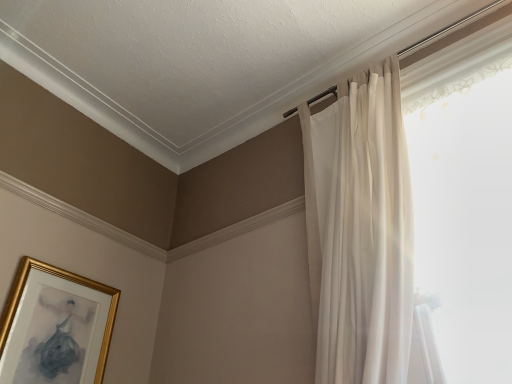
Question: Is gold-framed picture at lower left to the right of sheer white curtain at upper right from the viewer's perspective?

Choices:
 (A) yes
 (B) no

Answer: (B)

Question: From the image's perspective, is gold-framed picture at lower left located beneath sheer white curtain at upper right?

Choices:
 (A) no
 (B) yes

Answer: (B)

Question: From the image's perspective, is gold-framed picture at lower left over sheer white curtain at upper right?

Choices:
 (A) yes
 (B) no

Answer: (B)

Question: From a real-world perspective, is gold-framed picture at lower left on sheer white curtain at upper right?

Choices:
 (A) no
 (B) yes

Answer: (A)

Question: Would you say gold-framed picture at lower left is outside sheer white curtain at upper right?

Choices:
 (A) no
 (B) yes

Answer: (B)

Question: Is gold-framed picture at lower left looking in the opposite direction of sheer white curtain at upper right?

Choices:
 (A) no
 (B) yes

Answer: (A)

Question: Is sheer white curtain at upper right positioned in front of gold-framed picture at lower left?

Choices:
 (A) yes
 (B) no

Answer: (A)

Question: Is sheer white curtain at upper right facing away from gold-framed picture at lower left?

Choices:
 (A) yes
 (B) no

Answer: (B)

Question: Is sheer white curtain at upper right positioned far away from gold-framed picture at lower left?

Choices:
 (A) yes
 (B) no

Answer: (A)

Question: Considering the relative positions of sheer white curtain at upper right and gold-framed picture at lower left in the image provided, is sheer white curtain at upper right to the right of gold-framed picture at lower left from the viewer's perspective?

Choices:
 (A) no
 (B) yes

Answer: (B)

Question: Can you confirm if sheer white curtain at upper right is bigger than gold-framed picture at lower left?

Choices:
 (A) yes
 (B) no

Answer: (A)

Question: Does sheer white curtain at upper right appear on the left side of gold-framed picture at lower left?

Choices:
 (A) no
 (B) yes

Answer: (A)

Question: From the image's perspective, is gold-framed picture at lower left located above or below sheer white curtain at upper right?

Choices:
 (A) above
 (B) below

Answer: (B)